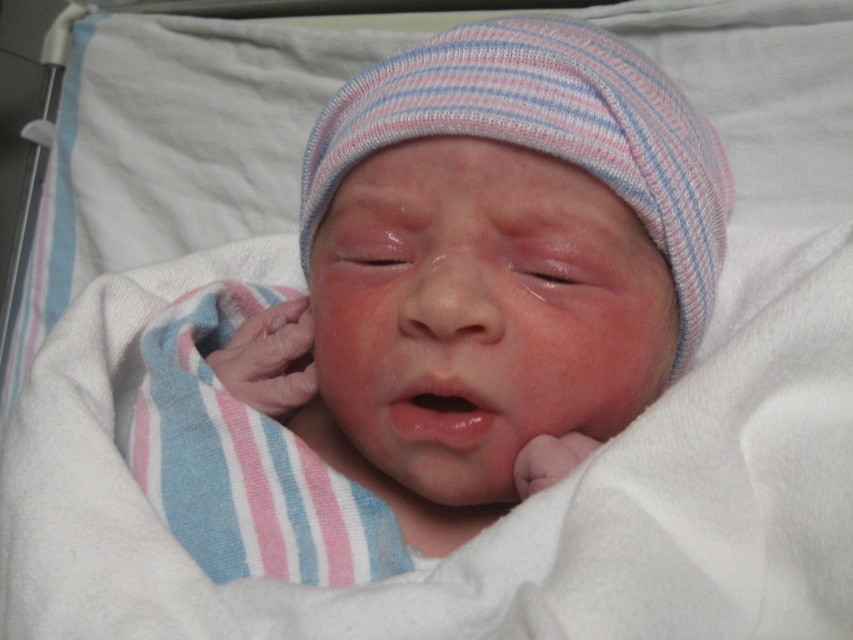
Question: Which object is closer to the camera taking this photo?

Choices:
 (A) striped knit hat at center
 (B) pink matte/skin-like mouth at center

Answer: (B)

Question: Is striped knit hat at center behind pink matte/skin-like mouth at center?

Choices:
 (A) yes
 (B) no

Answer: (A)

Question: Among these points, which one is farthest from the camera?

Choices:
 (A) (432, 412)
 (B) (599, 61)

Answer: (B)

Question: From the image, what is the correct spatial relationship of striped knit hat at center in relation to pink matte/skin-like mouth at center?

Choices:
 (A) right
 (B) left

Answer: (A)

Question: Is striped knit hat at center below pink matte/skin-like mouth at center?

Choices:
 (A) yes
 (B) no

Answer: (B)